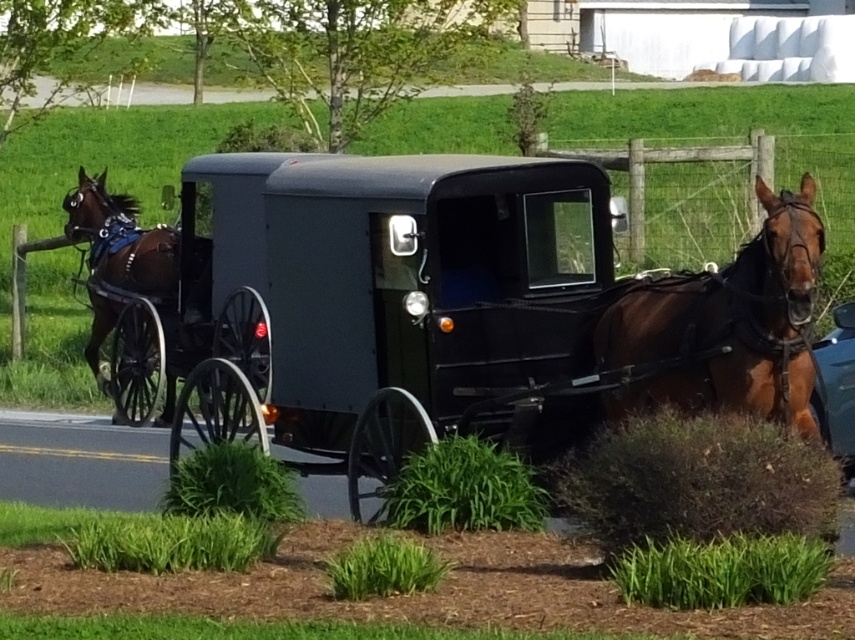
Question: Which of these objects is positioned closest to the blue glossy car at right?

Choices:
 (A) matte black horse cart at center
 (B) brown glossy horse at left
 (C) brown glossy horse at right

Answer: (C)

Question: Is matte black horse cart at center to the right of brown glossy horse at left from the viewer's perspective?

Choices:
 (A) yes
 (B) no

Answer: (A)

Question: Which object is positioned closest to the blue glossy car at right?

Choices:
 (A) brown glossy horse at right
 (B) brown glossy horse at left
 (C) matte black horse cart at center

Answer: (A)

Question: Which point is closer to the camera?

Choices:
 (A) brown glossy horse at left
 (B) blue glossy car at right
 (C) brown glossy horse at right

Answer: (C)

Question: Is brown glossy horse at right behind brown glossy horse at left?

Choices:
 (A) yes
 (B) no

Answer: (B)

Question: Does matte black horse cart at center appear on the right side of brown glossy horse at left?

Choices:
 (A) no
 (B) yes

Answer: (B)